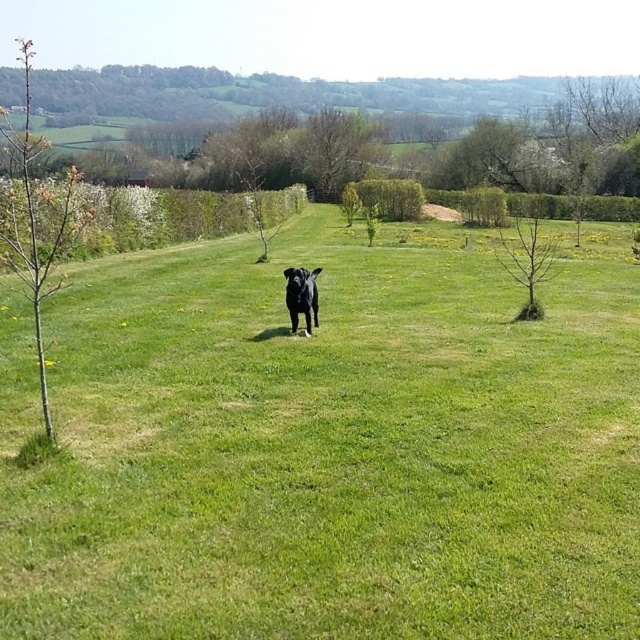
Question: Does green grassy field at center have a smaller size compared to black glossy dog at center?

Choices:
 (A) no
 (B) yes

Answer: (A)

Question: Which object is closer to the camera taking this photo?

Choices:
 (A) green leafy tree at left
 (B) green grassy field at center

Answer: (B)

Question: In this image, where is green grassy field at center located relative to black glossy dog at center?

Choices:
 (A) below
 (B) above

Answer: (A)

Question: Can you confirm if green grassy field at center is positioned below green leafy tree at left?

Choices:
 (A) yes
 (B) no

Answer: (A)

Question: Estimate the real-world distances between objects in this image. Which object is farther from the bare branch tree at center?

Choices:
 (A) green grassy field at center
 (B) green leafy tree at left
 (C) black glossy dog at center

Answer: (B)

Question: Which object appears farthest from the camera in this image?

Choices:
 (A) black glossy dog at center
 (B) green leafy tree at left
 (C) bare branch tree at center

Answer: (C)